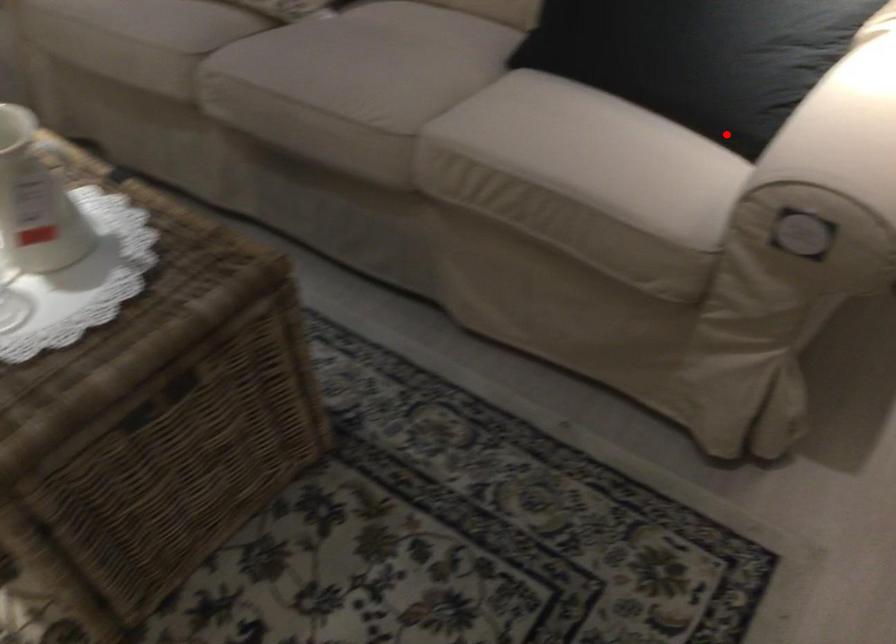
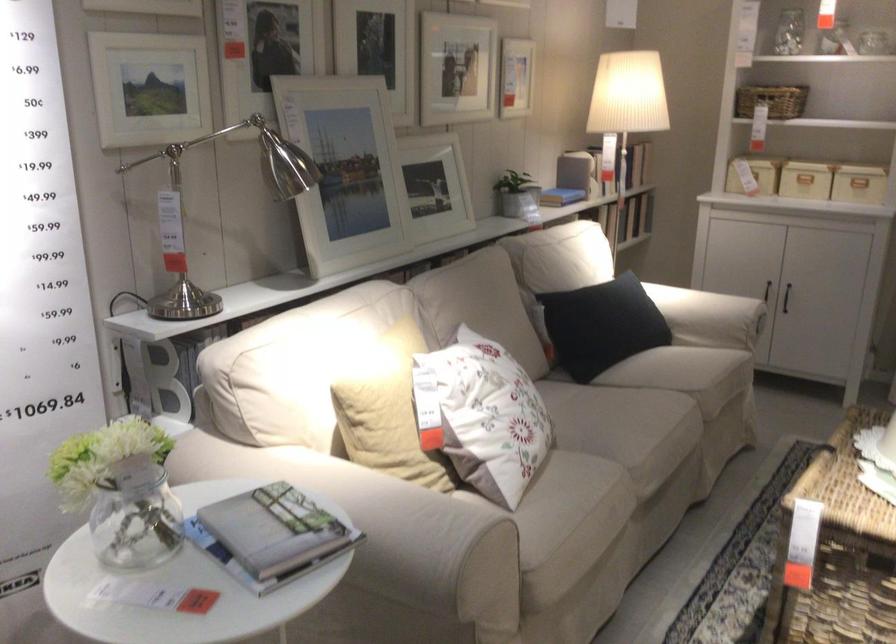
Question: I am providing you with two images of the same scene from different viewpoints. A red point is shown in image1. For the corresponding object point in image2, is it positioned nearer or farther from the camera?

Choices:
 (A) Nearer
 (B) Farther

Answer: (B)